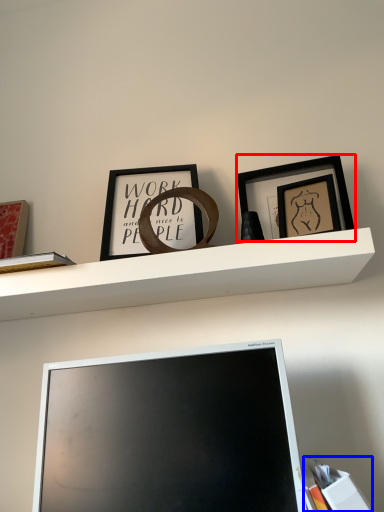
Question: Which object is closer to the camera taking this photo, picture frame (highlighted by a red box) or book (highlighted by a blue box)?

Choices:
 (A) picture frame
 (B) book

Answer: (B)